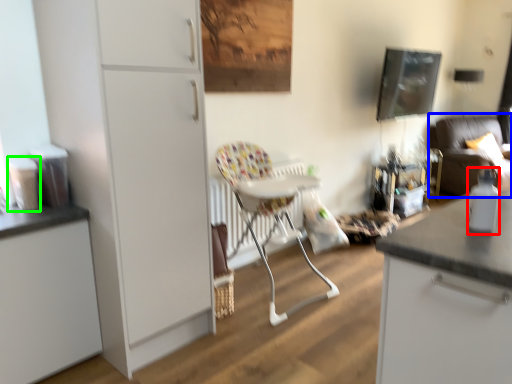
Question: Based on their relative distances, which object is farther from bottle (highlighted by a red box)? Choose from studio couch (highlighted by a blue box) and appliance (highlighted by a green box).

Choices:
 (A) studio couch
 (B) appliance

Answer: (A)